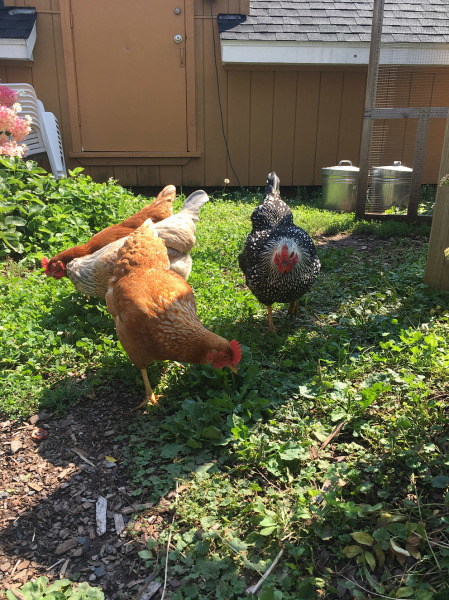
Image resolution: width=449 pixels, height=600 pixels. I want to click on chairs, so click(42, 124).